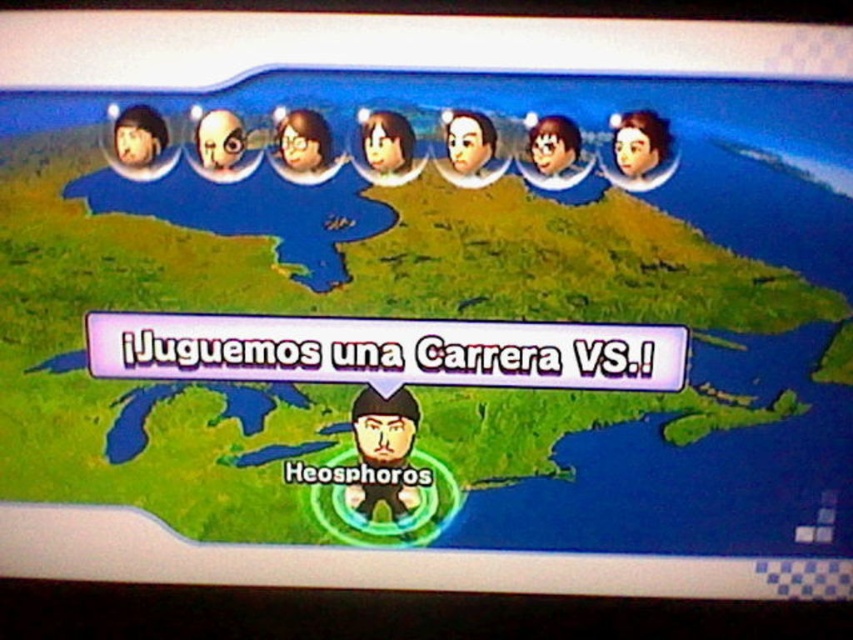
Looking at this image, you are a game developer checking the race setup. The matte black avatar at upper center and the shiny metallic helmet at upper left are both in the starting area. Which avatar is closer to the starting line?

The matte black avatar at upper center is closer to the starting line because the shiny metallic helmet at upper left is behind it.

You are a player in a racing game and need to determine the starting positions of two checkpoints. The first checkpoint is at point (387, 134) and the second is at point (215, 128). Which checkpoint is closer to your current position at the starting line?

The second checkpoint at point (215, 128) is closer to the starting line because it is less further to the camera compared to the first checkpoint at point (387, 134).

You are a game developer checking the race setup. You notice the matte black avatar at upper center and the shiny metallic helmet at upper left. Which avatar is taller in the game interface?

The matte black avatar at upper center is taller than the shiny metallic helmet at upper left.